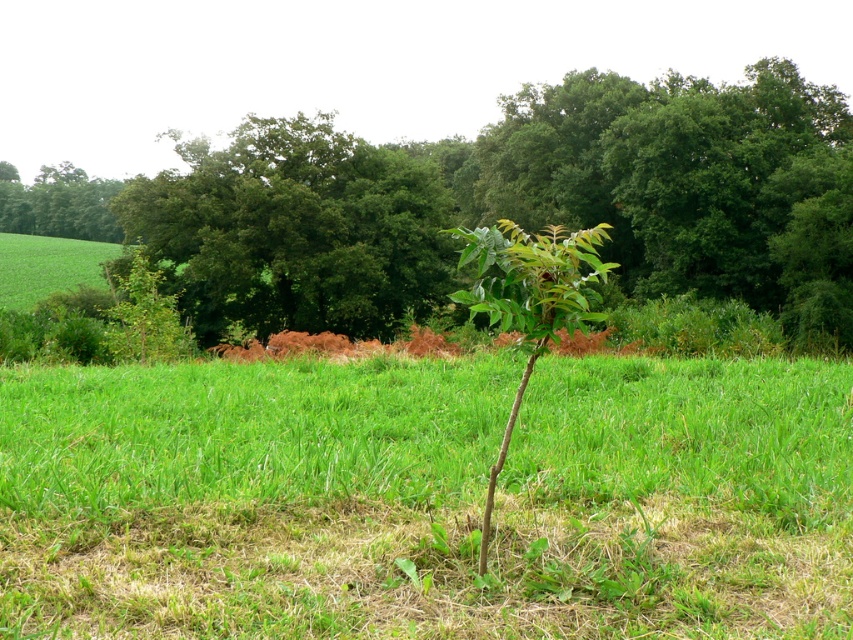
What do you see at coordinates (529, 300) in the screenshot? The image size is (853, 640). I see `green matte plant at center` at bounding box center [529, 300].

Can you confirm if green matte plant at center is shorter than green leafy tree at upper left?

Correct, green matte plant at center is not as tall as green leafy tree at upper left.

Is point (489, 243) positioned after point (80, 218)?

No, (489, 243) is in front of (80, 218).

Where is `green matte plant at center`? The width and height of the screenshot is (853, 640). green matte plant at center is located at coordinates (529, 300).

Measure the distance between green leafy plant at center and green leafy tree at upper left.

The distance of green leafy plant at center from green leafy tree at upper left is 117.80 meters.

Does green leafy plant at center appear under green leafy tree at upper left?

Indeed, green leafy plant at center is positioned under green leafy tree at upper left.

What do you see at coordinates (519, 204) in the screenshot? The height and width of the screenshot is (640, 853). I see `green leafy plant at center` at bounding box center [519, 204].

Locate an element on the screen. The width and height of the screenshot is (853, 640). green leafy plant at center is located at coordinates (519, 204).

Which of these two, green leafy tree at center or green matte plant at center, stands shorter?

Standing shorter between the two is green matte plant at center.

Does green leafy tree at center appear on the right side of green matte plant at center?

Incorrect, green leafy tree at center is not on the right side of green matte plant at center.

What do you see at coordinates (294, 230) in the screenshot? The height and width of the screenshot is (640, 853). I see `green leafy tree at center` at bounding box center [294, 230].

The height and width of the screenshot is (640, 853). I want to click on green leafy tree at center, so click(294, 230).